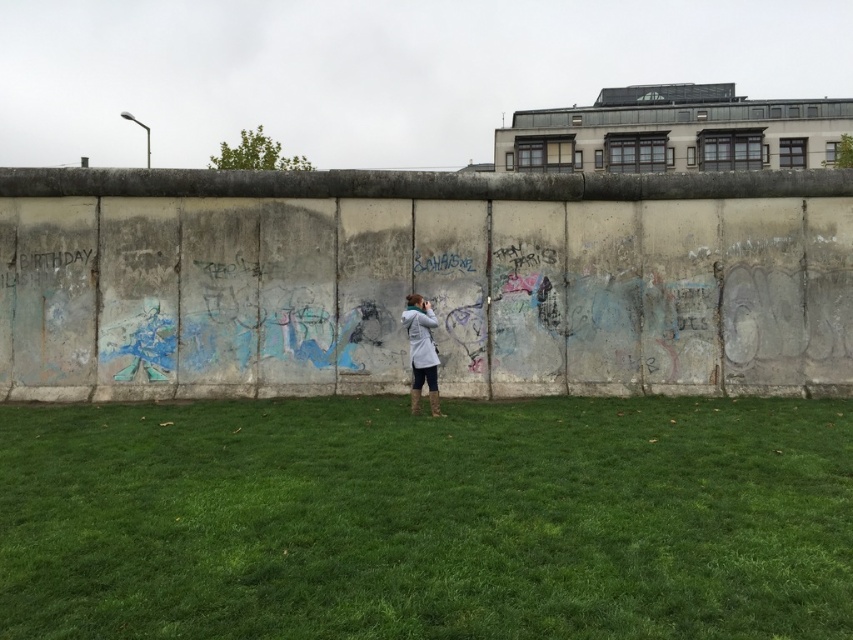
You are a photographer trying to capture the graffiti wall. You notice the green grass at center and the light gray fabric jacket at center in your frame. Which object occupies more space horizontally in the image?

The light gray fabric jacket at center occupies more horizontal space in the image since the green grass at center has a lesser width compared to it.

You are standing on the grassy area in front of the graffiti wall. There are two points marked on the ground. One is at coordinates point (51, 541) and the other at point (426, 371). Which point is closer to you?

Point (51, 541) is in front of point (426, 371), so the point closer to you is point (51, 541).

You are standing in front of the graffiti wall and want to step onto the green grass at center without stepping on the light gray fabric jacket at center. Which direction should you move from your current position?

Since the green grass at center is to the right of the light gray fabric jacket at center, you should move to the right to step onto the green grass at center without stepping on the jacket.